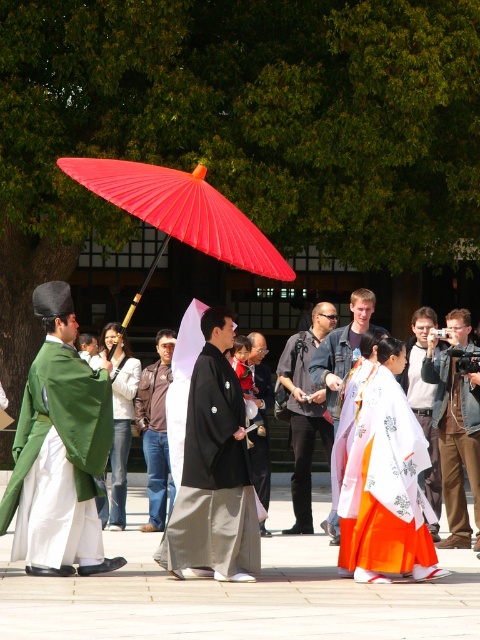
Question: In this image, where is denim jacket at center located relative to jeans at center?

Choices:
 (A) above
 (B) below

Answer: (A)

Question: Which point is farther to the camera?

Choices:
 (A) (420, 416)
 (B) (309, 380)
 (C) (260, 417)
 (D) (36, 452)

Answer: (B)

Question: From the image, what is the correct spatial relationship of green silk kimono at left in relation to brown leather camera at center?

Choices:
 (A) right
 (B) left

Answer: (B)

Question: Which point is farther from the camera taking this photo?

Choices:
 (A) (156, 364)
 (B) (240, 493)
 (C) (342, 332)

Answer: (A)

Question: Considering the real-world distances, which object is farthest from the matte black camera at center?

Choices:
 (A) denim jacket at center
 (B) dark gray denim jacket at center
 (C) black matte kimono at center

Answer: (C)

Question: Does white satin kimono at center appear over jeans at center?

Choices:
 (A) no
 (B) yes

Answer: (A)